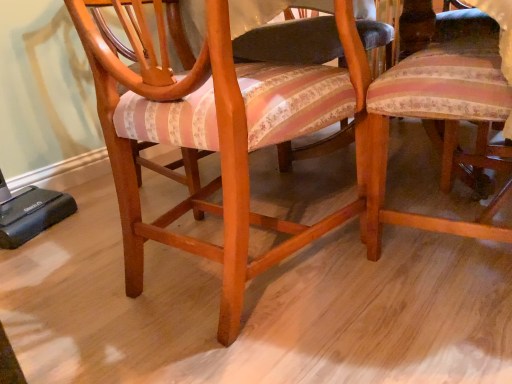
Question: Should I look upward or downward to see wooden chair at center?

Choices:
 (A) up
 (B) down

Answer: (A)